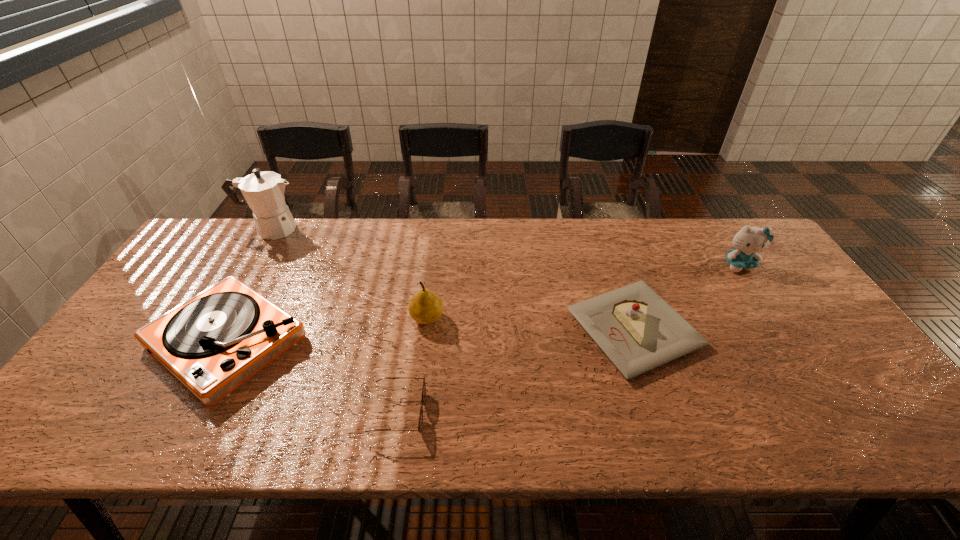
Locate an element on the screen. The height and width of the screenshot is (540, 960). object at the right edge is located at coordinates (748, 241).

Image resolution: width=960 pixels, height=540 pixels. In order to click on object situated at the far left corner in this screenshot , I will do `click(263, 191)`.

Where is `object positioned at the near left corner`? object positioned at the near left corner is located at coordinates (212, 343).

What are the coordinates of `object present at the far right corner` in the screenshot? It's located at 748,241.

This screenshot has width=960, height=540. Identify the location of vacant space at the far edge. (404, 258).

The image size is (960, 540). In order to click on vacant space at the near edge of the desktop in this screenshot , I will do `click(529, 416)`.

Identify the location of vacant space at the right edge of the desktop. This screenshot has height=540, width=960. (772, 322).

Where is `free point at the far left corner`? The width and height of the screenshot is (960, 540). free point at the far left corner is located at coordinates (227, 219).

Identify the location of vacant space at the near left corner of the desktop. The width and height of the screenshot is (960, 540). (67, 436).

Identify the location of vacant space in between the rightmost object and the coffeepot. (505, 247).